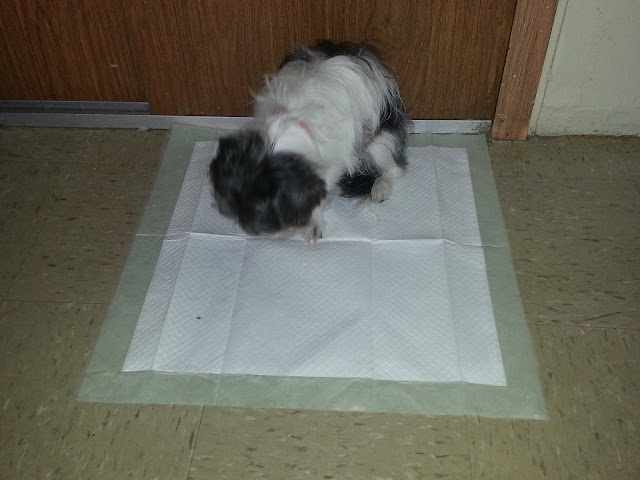
Identify the location of linoleum floor. The height and width of the screenshot is (480, 640). (84, 251).